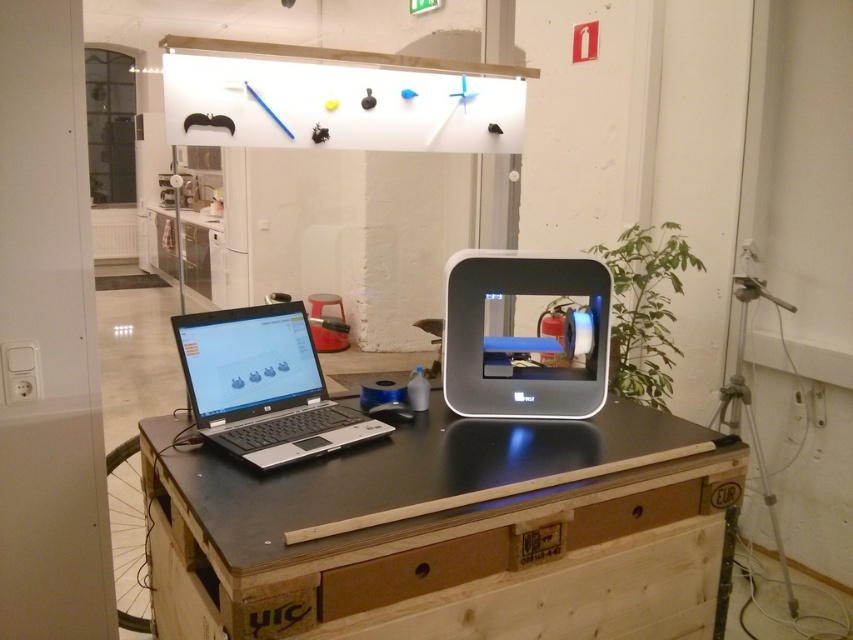
Question: In this image, where is black matte table at center located relative to wooden drawer at center?

Choices:
 (A) right
 (B) left

Answer: (A)

Question: Which object is farther from the camera taking this photo?

Choices:
 (A) black matte table at center
 (B) black matte laptop at left

Answer: (B)

Question: Which object is closer to the camera taking this photo?

Choices:
 (A) black matte laptop at left
 (B) black matte table at center
 (C) wooden drawer at center
 (D) wooden drawer at lower center

Answer: (B)

Question: Does wooden drawer at center have a greater width compared to wooden drawer at lower center?

Choices:
 (A) yes
 (B) no

Answer: (B)

Question: Which object is positioned closest to the black matte table at center?

Choices:
 (A) wooden drawer at center
 (B) black matte laptop at left

Answer: (A)

Question: Does wooden drawer at center appear on the left side of wooden drawer at lower center?

Choices:
 (A) no
 (B) yes

Answer: (B)